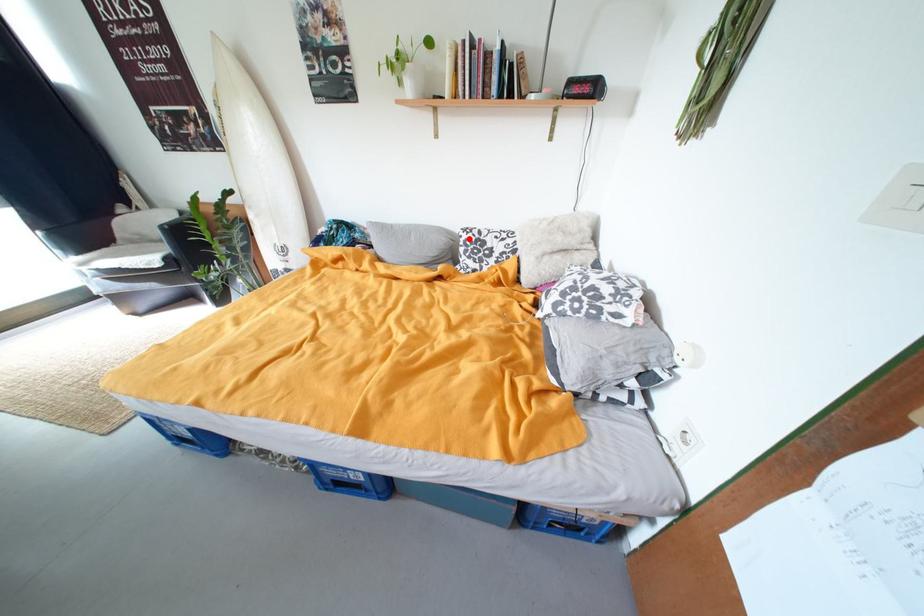
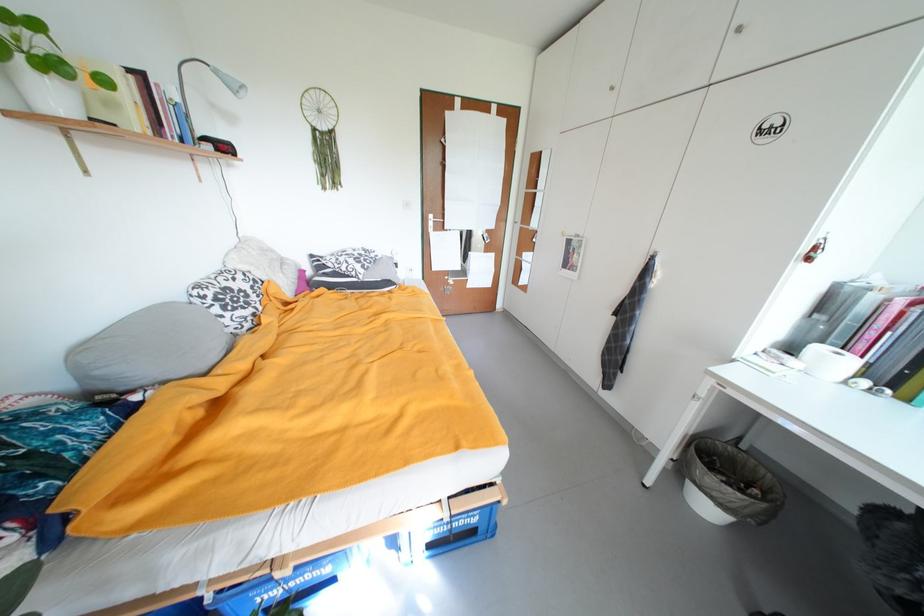
Find the pixel in the second image that matches the highlighted location in the first image.

(211, 299)